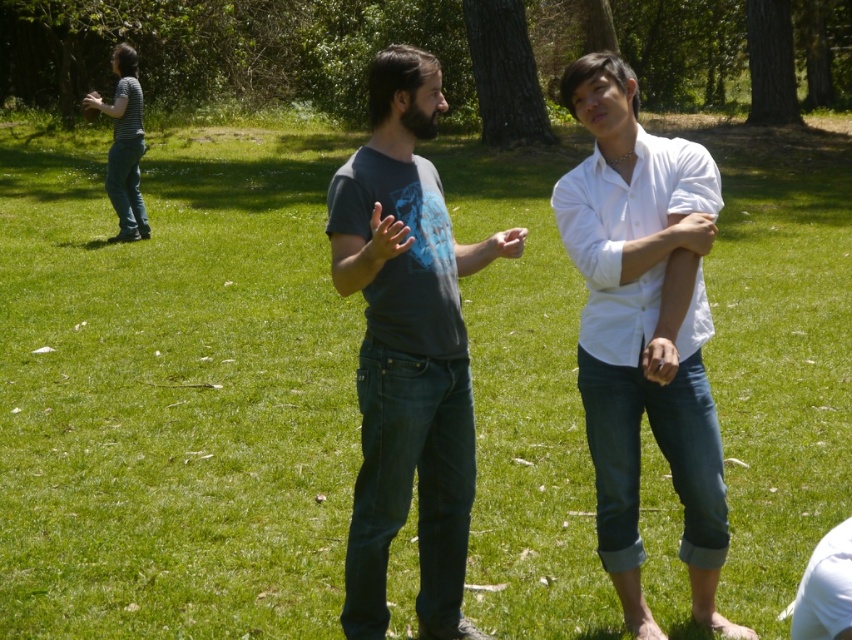
You are standing in the outdoor scene and want to walk from point A to point B. Point A is located at coordinate point [632,195] and point B is at coordinate point [390,80]. Which direction should you move to get closer to point B?

To move from point A at [632,195] to point B at [390,80], you should move diagonally towards the lower left direction since point B is closer to the viewer compared to point A.